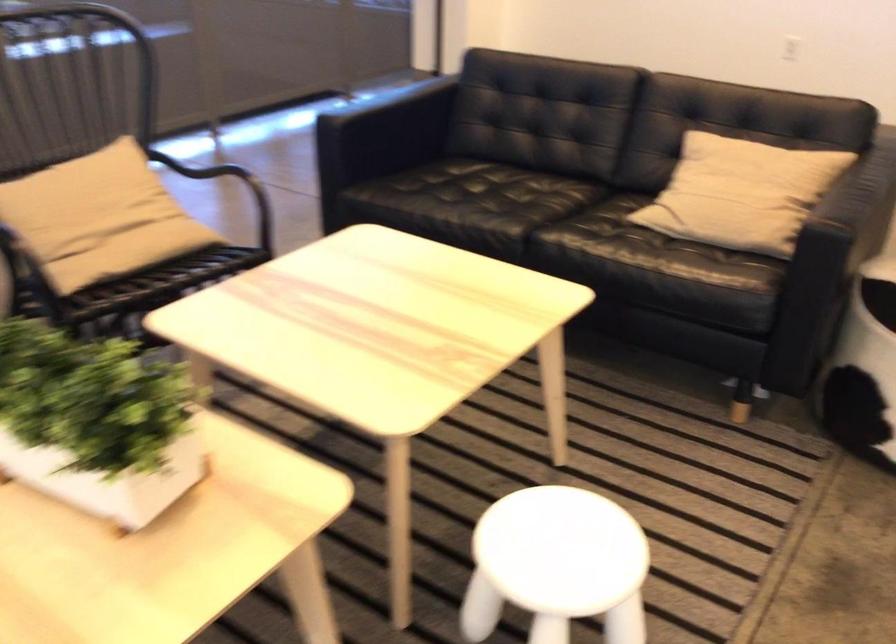
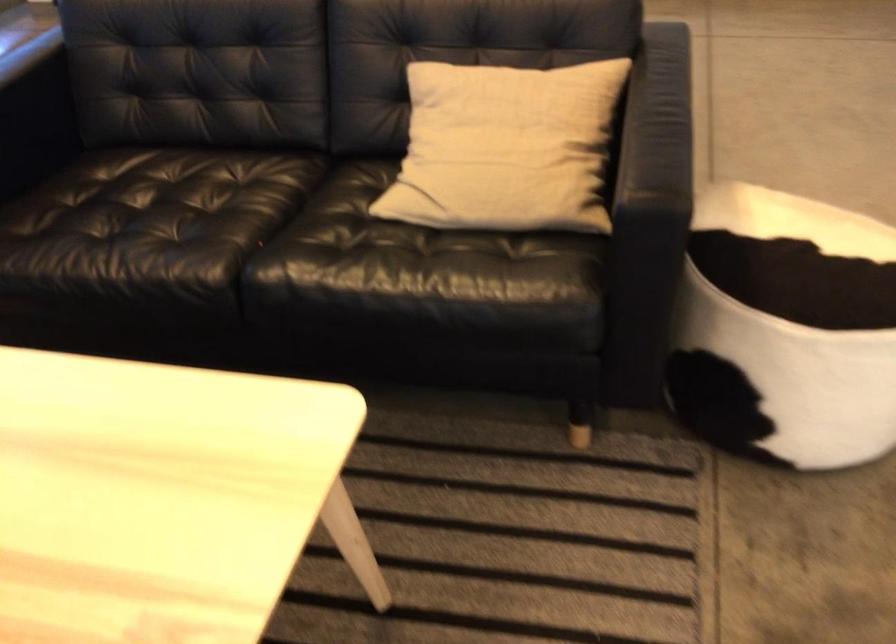
In the second image, find the point that corresponds to point (805, 298) in the first image.

(644, 298)